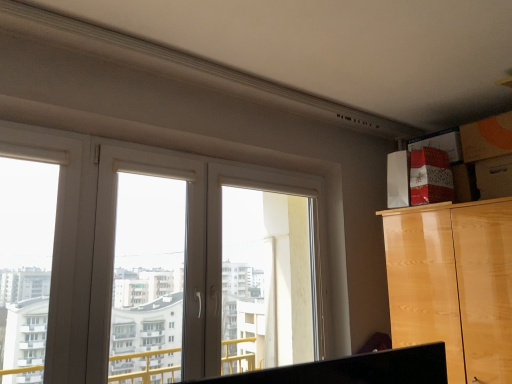
Question: Looking at their shapes, would you say wooden drawer at upper right is wider or thinner than white plastic window frame at center, the 2th window frame positioned from the left?

Choices:
 (A) thin
 (B) wide

Answer: (B)

Question: Considering the positions of wooden drawer at upper right and white plastic window frame at center, which ranks as the 1th window frame in right-to-left order, in the image, is wooden drawer at upper right taller or shorter than white plastic window frame at center, which ranks as the 1th window frame in right-to-left order,?

Choices:
 (A) tall
 (B) short

Answer: (B)

Question: Which of these objects is positioned closest to the glossy wood cabinet at upper right?

Choices:
 (A) white plastic window frame at center, which ranks as the 1th window frame in right-to-left order
 (B) wooden drawer at upper right
 (C) white plastic window at center, which is the 2th window frame from right to left

Answer: (B)

Question: Which is nearer to the white plastic window at center, which is the 2th window frame from right to left?

Choices:
 (A) glossy wood cabinet at upper right
 (B) wooden drawer at upper right
 (C) white plastic window frame at center, which ranks as the 1th window frame in right-to-left order

Answer: (C)